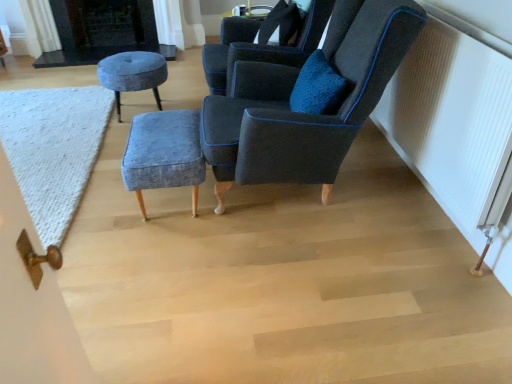
You are a GUI agent. You are given a task and a screenshot of the screen. Output one action in this format:
    pyautogui.click(x=<x>, y=<y>)
    Task: Click on the free spot in front of denim fabric stool at center, positioned as the 2th stool in left-to-right order
    
    Given the screenshot: What is the action you would take?
    pyautogui.click(x=158, y=254)